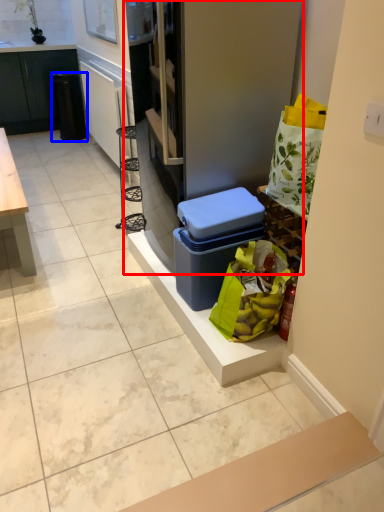
Question: Which object is further to the camera taking this photo, fridge (highlighted by a red box) or trash bin/can (highlighted by a blue box)?

Choices:
 (A) fridge
 (B) trash bin/can

Answer: (B)